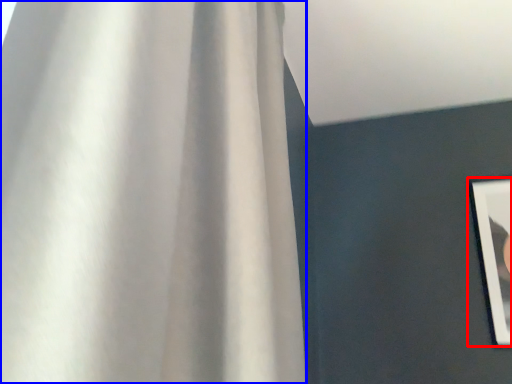
Question: Which object appears farthest to the camera in this image, picture frame (highlighted by a red box) or curtain (highlighted by a blue box)?

Choices:
 (A) picture frame
 (B) curtain

Answer: (A)